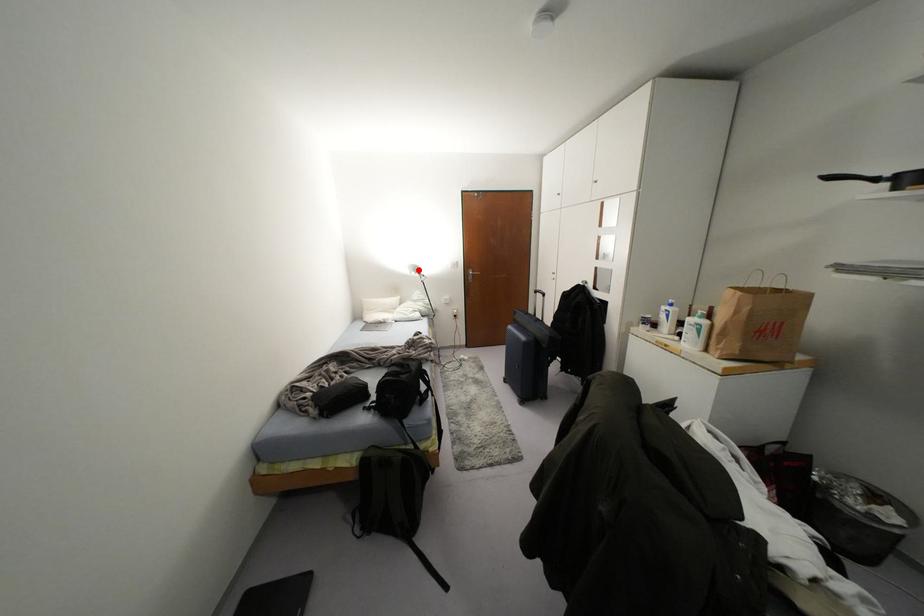
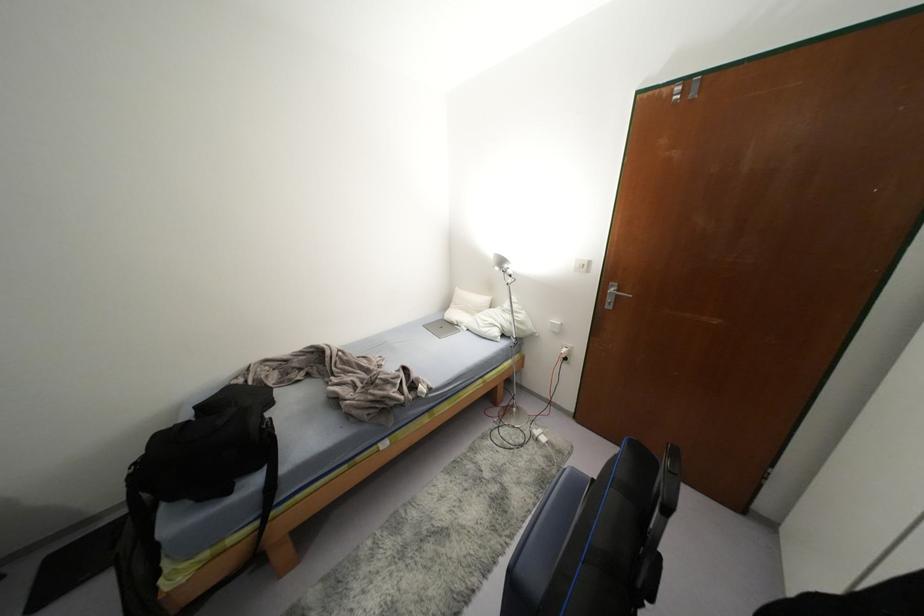
Where in the second image is the point corresponding to the highlighted location from the first image?

(505, 265)